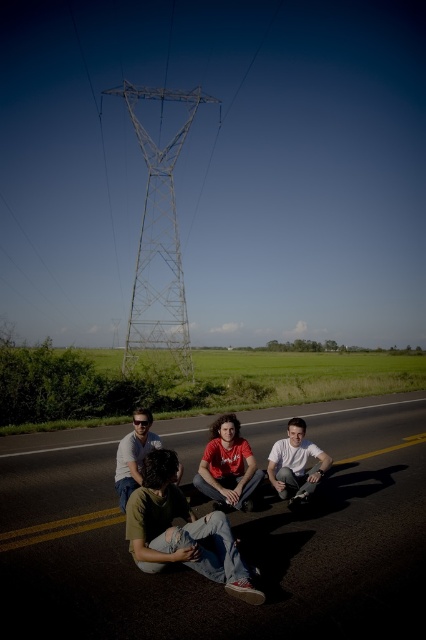
Is point (198, 470) closer to camera compared to point (137, 420)?

That is True.

Is matte red t-shirt at center above matte white shirt at lower left?

No, matte red t-shirt at center is not above matte white shirt at lower left.

Which is behind, point (230, 481) or point (132, 417)?

The point (132, 417) is more distant.

At what (x,y) coordinates should I click in order to perform the action: click on matte red t-shirt at center. Please return your answer as a coordinate pair (x, y). Looking at the image, I should click on (227, 467).

Where is `light gray smooth skateboard at center`? Image resolution: width=426 pixels, height=640 pixels. light gray smooth skateboard at center is located at coordinates (296, 465).

Does light gray smooth skateboard at center have a greater height compared to matte white shirt at lower left?

Incorrect, light gray smooth skateboard at center's height is not larger of matte white shirt at lower left's.

This screenshot has height=640, width=426. Identify the location of light gray smooth skateboard at center. (296, 465).

Where is `light gray smooth skateboard at center`? light gray smooth skateboard at center is located at coordinates (296, 465).

Which is more to the left, black asphalt highway at center or green denim jeans at lower left?

black asphalt highway at center

Is point (26, 632) positioned after point (207, 534)?

No, it is not.

Between point (48, 570) and point (161, 561), which one is positioned in front?

Point (161, 561) is more forward.

Where is `black asphalt highway at center`? This screenshot has height=640, width=426. black asphalt highway at center is located at coordinates (236, 536).